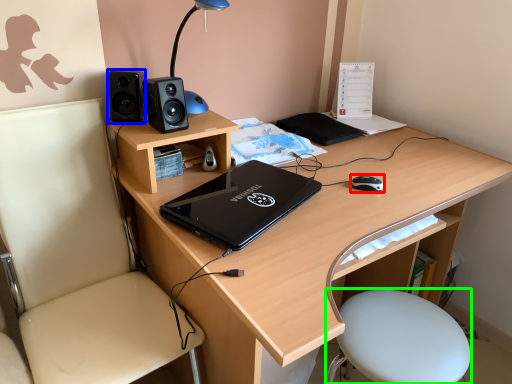
Question: Which object is the closest to the mouse (highlighted by a red box)? Choose among these: speaker (highlighted by a blue box) or bar stool (highlighted by a green box).

Choices:
 (A) speaker
 (B) bar stool

Answer: (B)